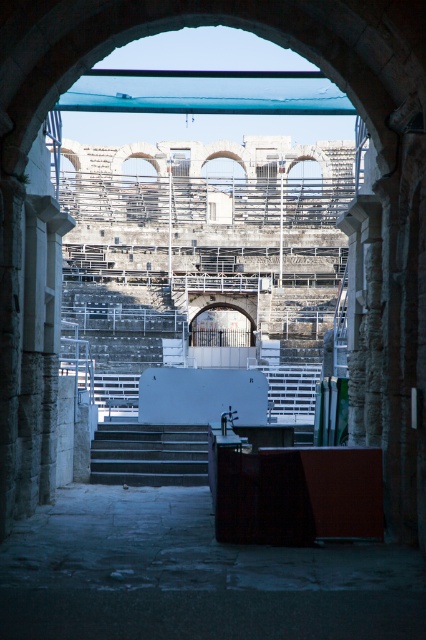
How distant is dark gray concrete stairs at center from white plastic stairs at center?

dark gray concrete stairs at center is 84.42 feet away from white plastic stairs at center.

Can you confirm if dark gray concrete stairs at center is positioned below white plastic stairs at center?

Indeed, dark gray concrete stairs at center is positioned under white plastic stairs at center.

Image resolution: width=426 pixels, height=640 pixels. Describe the element at coordinates (149, 454) in the screenshot. I see `dark gray concrete stairs at center` at that location.

At what (x,y) coordinates should I click in order to perform the action: click on dark gray concrete stairs at center. Please return your answer as a coordinate pair (x, y). The width and height of the screenshot is (426, 640). Looking at the image, I should click on (149, 454).